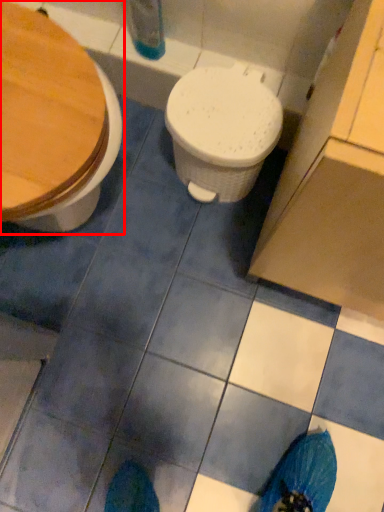
Question: Where is toilet (annotated by the red box) located in relation to toilet in the image?

Choices:
 (A) left
 (B) right

Answer: (A)